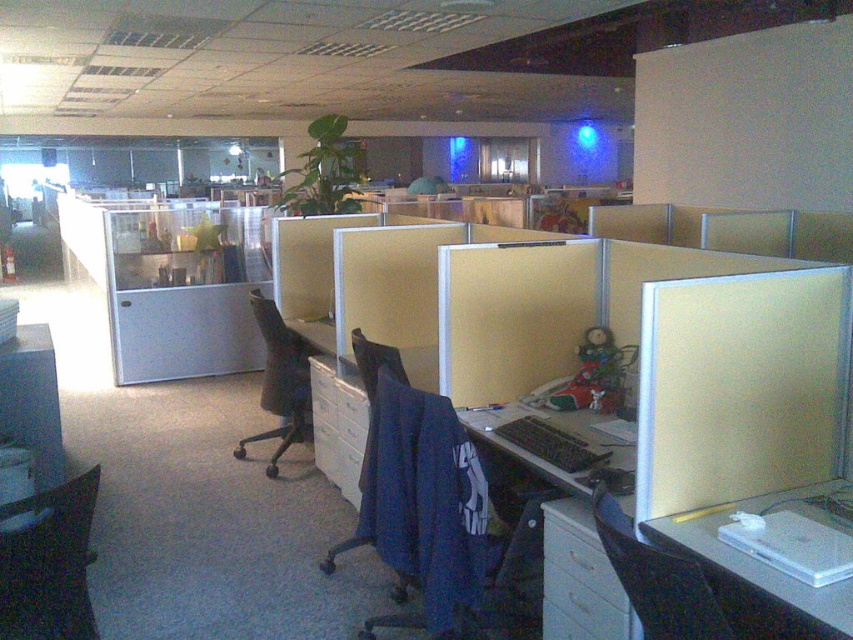
You are a GUI agent. You are given a task and a screenshot of the screen. Output one action in this format:
    pyautogui.click(x=<x>, y=<y>)
    Task: Click on the blue fabric swivel chair at center
    The image size is (853, 640).
    Given the screenshot: What is the action you would take?
    pyautogui.click(x=444, y=524)

Find the location of a particular element. This screenshot has height=640, width=853. blue fabric swivel chair at center is located at coordinates (444, 524).

Locate an element on the screen. blue fabric swivel chair at center is located at coordinates (444, 524).

Which is behind, point (496, 554) or point (256, 436)?

Positioned behind is point (256, 436).

Find the location of a particular element. blue fabric swivel chair at center is located at coordinates (444, 524).

Does white plastic table at lower right appear over black fabric chair at lower right?

No.

Between white plastic table at lower right and black fabric chair at lower right, which one is positioned higher?

Positioned higher is black fabric chair at lower right.

In order to click on white plastic table at lower right in this screenshot , I will do `click(759, 570)`.

Image resolution: width=853 pixels, height=640 pixels. Identify the location of white plastic table at lower right. [759, 570].